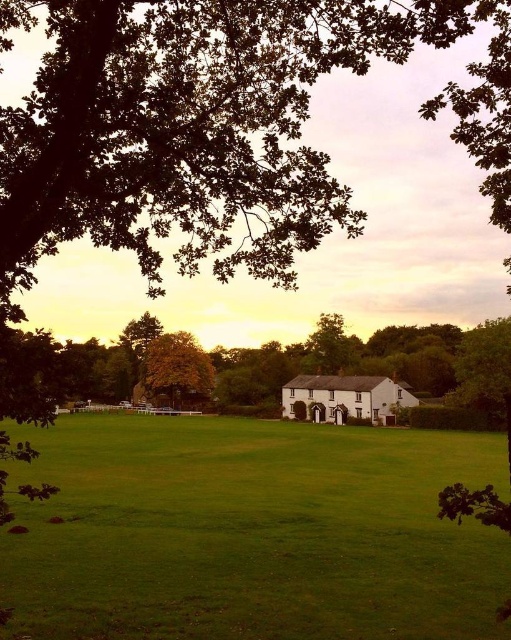
Question: Estimate the real-world distances between objects in this image. Which object is farther from the green leafy tree at center?

Choices:
 (A) yellow-green leaves at center
 (B) green grass field at center

Answer: (B)

Question: Considering the real-world distances, which object is closest to the green grass field at center?

Choices:
 (A) green leafy tree at center
 (B) yellow-green leaves at center

Answer: (A)

Question: Is green grass field at center positioned at the back of green leafy tree at center?

Choices:
 (A) yes
 (B) no

Answer: (A)

Question: Which point appears closest to the camera in this image?

Choices:
 (A) (152, 380)
 (B) (280, 344)
 (C) (39, 506)

Answer: (C)

Question: In this image, where is green leafy tree at center located relative to yellow-green leaves at center?

Choices:
 (A) below
 (B) above

Answer: (B)

Question: From the image, what is the correct spatial relationship of green leafy tree at center in relation to yellow-green leaves at center?

Choices:
 (A) below
 (B) above

Answer: (B)